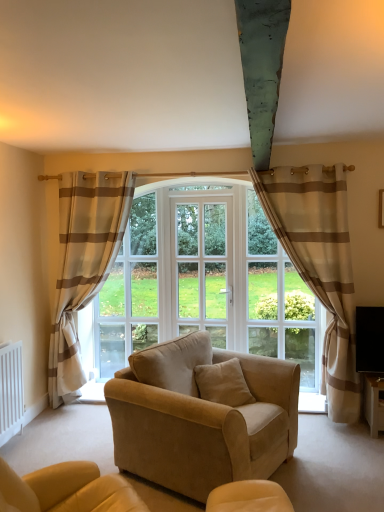
Locate an element on the screen. vacant area that is in front of beige striped curtain at left, acting as the second curtain starting from the right is located at coordinates (70, 434).